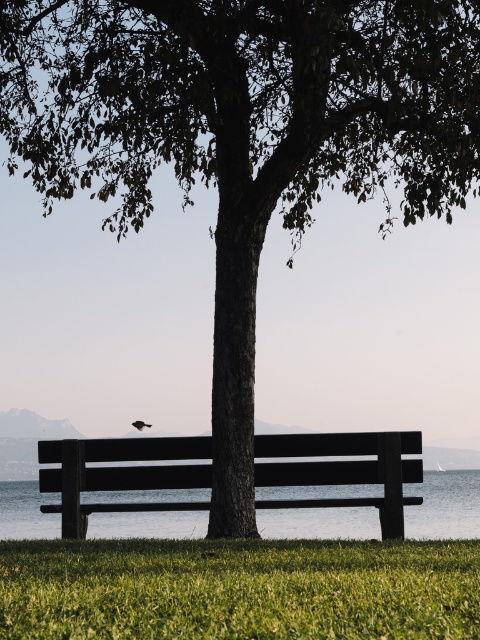
You are sitting on the smooth dark wood bench at center in the park. You notice a silhouette feathered bird at center flying above you. From your perspective, where does the bird appear relative to the bench?

The smooth dark wood bench at center is in front of the silhouette feathered bird at center, so the bird would appear behind the bench from your seated position.